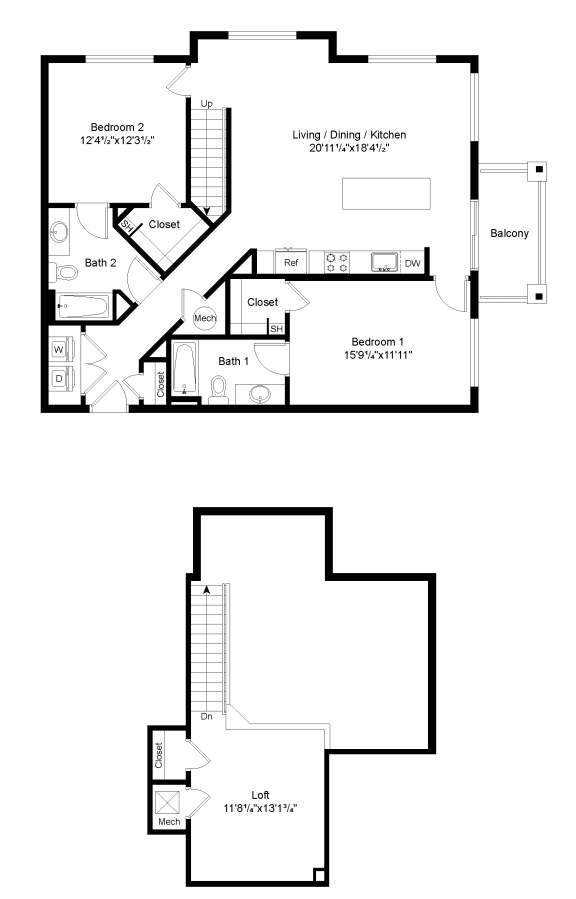
Where is `bedrooms`? bedrooms is located at coordinates (125, 127), (393, 343).